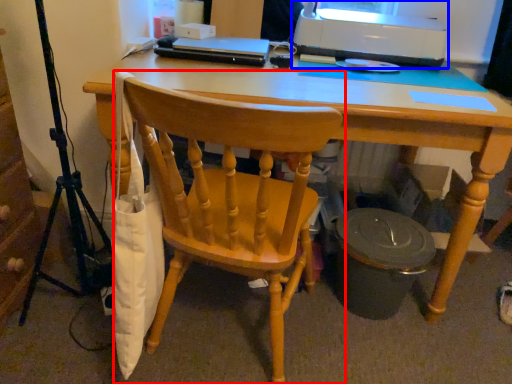
Question: Which point is closer to the camera, chair (highlighted by a red box) or printer (highlighted by a blue box)?

Choices:
 (A) chair
 (B) printer

Answer: (A)